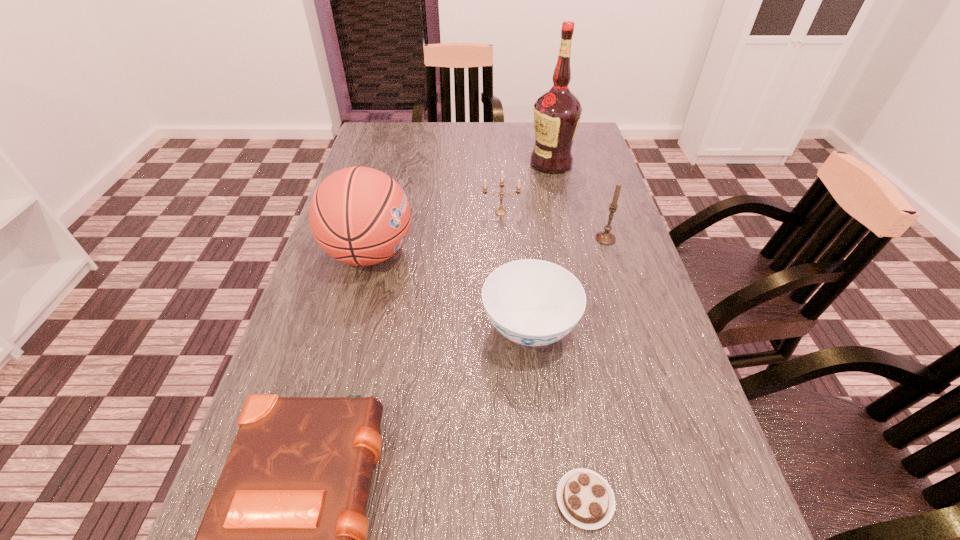
Identify the location of alcohol that is positioned at the right edge. (557, 112).

You are a GUI agent. You are given a task and a screenshot of the screen. Output one action in this format:
    pyautogui.click(x=<x>, y=<y>)
    Task: Click on the candle located at the right edge
    The height and width of the screenshot is (540, 960).
    Given the screenshot: What is the action you would take?
    pyautogui.click(x=605, y=237)

Where is `object present at the far right corner`? Image resolution: width=960 pixels, height=540 pixels. object present at the far right corner is located at coordinates (557, 112).

I want to click on blank space at the far edge, so click(x=463, y=122).

The image size is (960, 540). In the image, there is a desktop. Identify the location of free space at the left edge. (329, 284).

I want to click on free space at the right edge of the desktop, so click(x=628, y=339).

At what (x,y) coordinates should I click in order to perform the action: click on free spot between the shortest object and the third tallest object. Please return your answer as a coordinate pair (x, y). Image resolution: width=960 pixels, height=540 pixels. Looking at the image, I should click on (595, 369).

In order to click on vacant area between the tallest object and the shorter candle in this screenshot , I will do `click(526, 188)`.

Where is `vacant region between the second tallest object and the chocolate cake`? The width and height of the screenshot is (960, 540). vacant region between the second tallest object and the chocolate cake is located at coordinates (477, 376).

Locate an element on the screen. This screenshot has height=540, width=960. vacant area that lies between the farther candle and the chocolate cake is located at coordinates (542, 356).